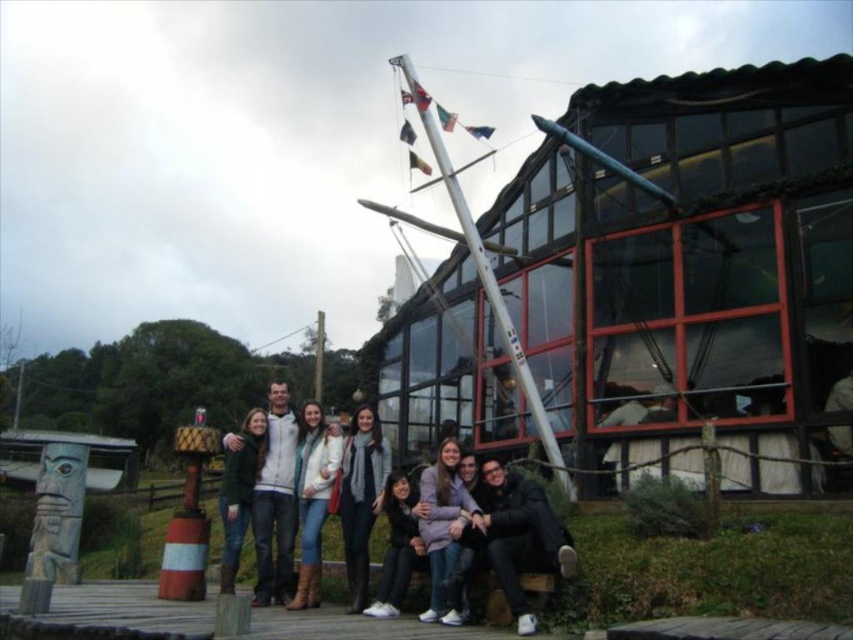
Where is `knitted scarf at center`? knitted scarf at center is located at coordinates (360, 497).

Does knitted scarf at center have a greater height compared to green wool sweater at center?

Incorrect, knitted scarf at center's height is not larger of green wool sweater at center's.

Find the location of a particular element. The width and height of the screenshot is (853, 640). knitted scarf at center is located at coordinates (360, 497).

Who is positioned more to the right, white woolen sweater at center or light brown leather jacket at center?

light brown leather jacket at center is more to the right.

Who is lower down, white woolen sweater at center or light brown leather jacket at center?

white woolen sweater at center is below.

The width and height of the screenshot is (853, 640). What do you see at coordinates (312, 497) in the screenshot?
I see `white woolen sweater at center` at bounding box center [312, 497].

Locate an element on the screen. This screenshot has height=640, width=853. white woolen sweater at center is located at coordinates (312, 497).

Locate an element on the screen. Image resolution: width=853 pixels, height=640 pixels. white fleece jacket at center is located at coordinates (276, 500).

Can you confirm if white fleece jacket at center is positioned to the right of white woolen sweater at center?

In fact, white fleece jacket at center is to the left of white woolen sweater at center.

Locate an element on the screen. This screenshot has width=853, height=640. white fleece jacket at center is located at coordinates (276, 500).